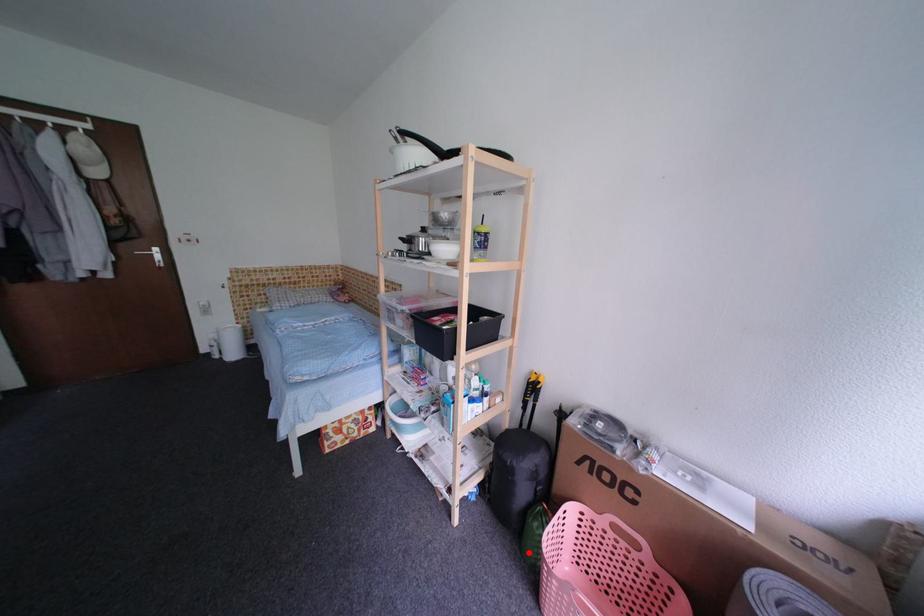
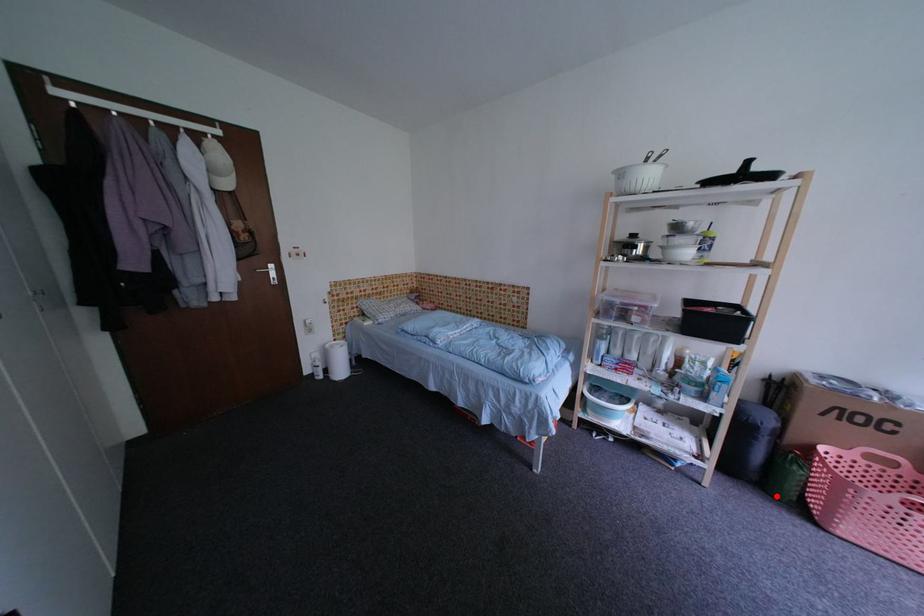
I am providing you with two images of the same scene from different viewpoints. A red point is marked on the first image and another point is marked on the second image. Does the point marked in image1 correspond to the same location as the one in image2?

Yes